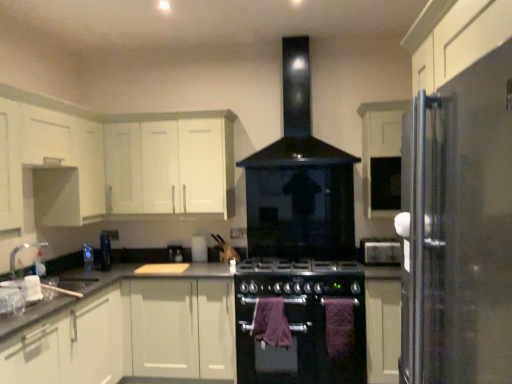
Question: Is the surface of satin black kettle at center, which appears as the 1th appliance when viewed from the back, in direct contact with black matte oven at center?

Choices:
 (A) no
 (B) yes

Answer: (A)

Question: From the image's perspective, is satin black kettle at center, which appears as the 1th appliance when viewed from the back, on top of black matte oven at center?

Choices:
 (A) yes
 (B) no

Answer: (A)

Question: Considering the relative positions of satin black kettle at center, the first appliance from the left, and black matte oven at center in the image provided, is satin black kettle at center, the first appliance from the left, to the left of black matte oven at center from the viewer's perspective?

Choices:
 (A) yes
 (B) no

Answer: (A)

Question: Is satin black kettle at center, placed as the second appliance when sorted from right to left, looking in the opposite direction of black matte oven at center?

Choices:
 (A) yes
 (B) no

Answer: (B)

Question: Does satin black kettle at center, positioned as the second appliance in front-to-back order, come in front of black matte oven at center?

Choices:
 (A) no
 (B) yes

Answer: (A)

Question: Based on their sizes in the image, would you say satin black kettle at center, positioned as the second appliance in front-to-back order, is bigger or smaller than purple fabric towel at center, the second blanket in the right-to-left sequence?

Choices:
 (A) small
 (B) big

Answer: (A)

Question: From a real-world perspective, is satin black kettle at center, the first appliance from the left, positioned above or below purple fabric towel at center, marked as the first blanket in a left-to-right arrangement?

Choices:
 (A) below
 (B) above

Answer: (B)

Question: Would you say satin black kettle at center, which appears as the 1th appliance when viewed from the back, is to the left or to the right of purple fabric towel at center, marked as the first blanket in a left-to-right arrangement, in the picture?

Choices:
 (A) left
 (B) right

Answer: (A)

Question: Is satin black kettle at center, the first appliance from the left, inside or outside of purple fabric towel at center, marked as the first blanket in a left-to-right arrangement?

Choices:
 (A) outside
 (B) inside

Answer: (A)

Question: Is white matte cabinet at upper left, which is the 3th cabinetry in right-to-left order, inside the boundaries of black glass exhaust hood at center, or outside?

Choices:
 (A) outside
 (B) inside

Answer: (A)

Question: Relative to black glass exhaust hood at center, is white matte cabinet at upper left, which is the 3th cabinetry in right-to-left order, in front or behind?

Choices:
 (A) front
 (B) behind

Answer: (B)

Question: Considering the positions of white matte cabinet at upper left, the 3th cabinetry from the left, and black glass exhaust hood at center in the image, is white matte cabinet at upper left, the 3th cabinetry from the left, taller or shorter than black glass exhaust hood at center?

Choices:
 (A) tall
 (B) short

Answer: (B)

Question: Considering the relative positions of white matte cabinet at upper left, which is the 3th cabinetry in right-to-left order, and black glass exhaust hood at center in the image provided, is white matte cabinet at upper left, which is the 3th cabinetry in right-to-left order, to the left or to the right of black glass exhaust hood at center?

Choices:
 (A) left
 (B) right

Answer: (A)

Question: Choose the correct answer: Is black matte gas stove at center inside satin black kettle at center, positioned as the second appliance in front-to-back order, or outside it?

Choices:
 (A) inside
 (B) outside

Answer: (B)

Question: Is black matte gas stove at center in front of or behind satin black kettle at center, positioned as the second appliance in front-to-back order, in the image?

Choices:
 (A) front
 (B) behind

Answer: (A)